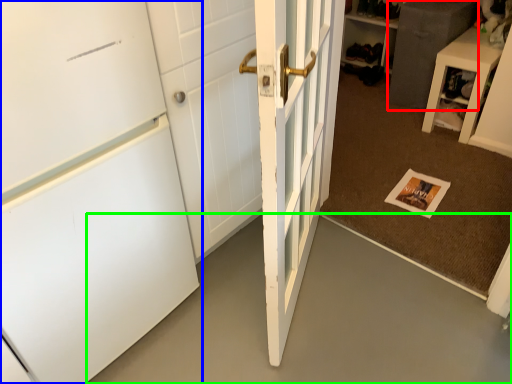
Question: Considering the real-world distances, which object is farthest from cabinetry (highlighted by a red box)? door (highlighted by a blue box) or concrete (highlighted by a green box)?

Choices:
 (A) door
 (B) concrete

Answer: (A)